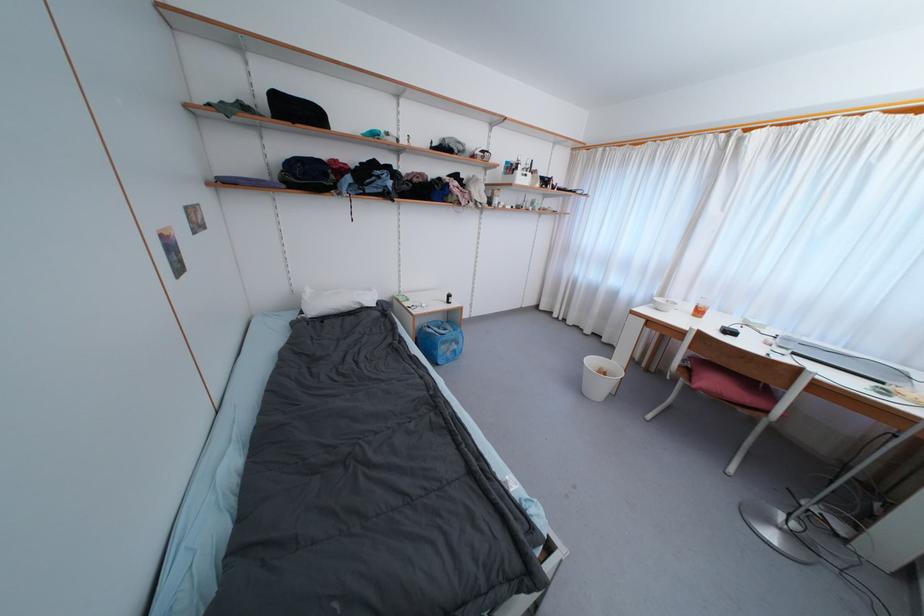
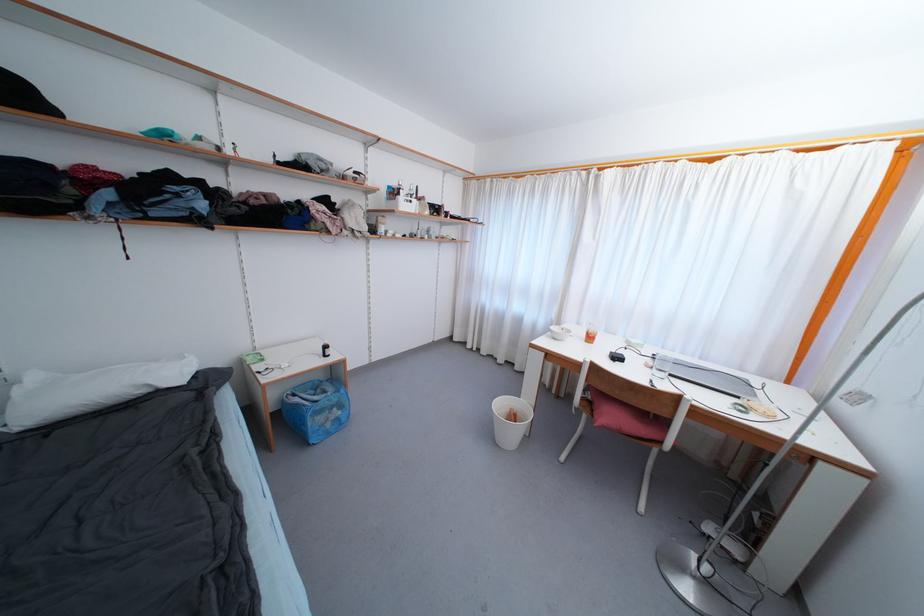
The point at (734, 334) is marked in the first image. Where is the corresponding point in the second image?

(621, 361)